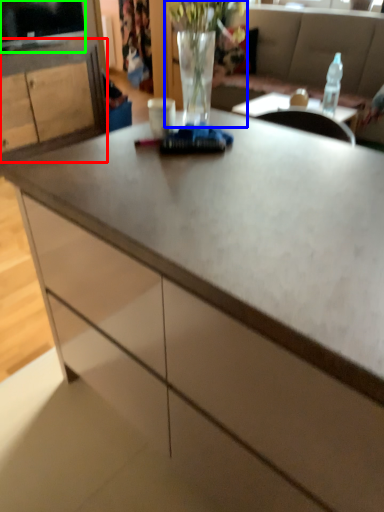
Question: Estimate the real-world distances between objects in this image. Which object is closer to cabinetry (highlighted by a red box), floral arrangement (highlighted by a blue box) or television (highlighted by a green box)?

Choices:
 (A) floral arrangement
 (B) television

Answer: (B)